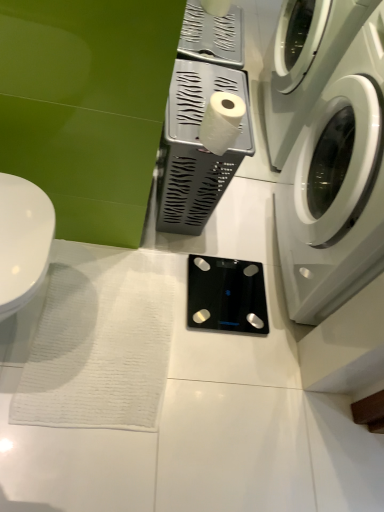
The height and width of the screenshot is (512, 384). In order to click on vacant space situated above white plastic tissue holder at center, which appears as the 2th appliance when ordered from the bottom (from a real-world perspective) in this screenshot , I will do `click(204, 90)`.